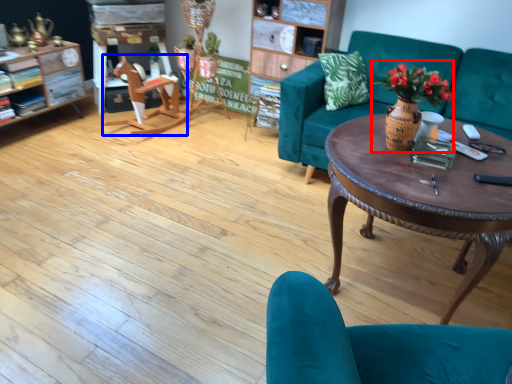
Question: Among these objects, which one is farthest to the camera, floral arrangement (highlighted by a red box) or wide (highlighted by a blue box)?

Choices:
 (A) floral arrangement
 (B) wide

Answer: (B)